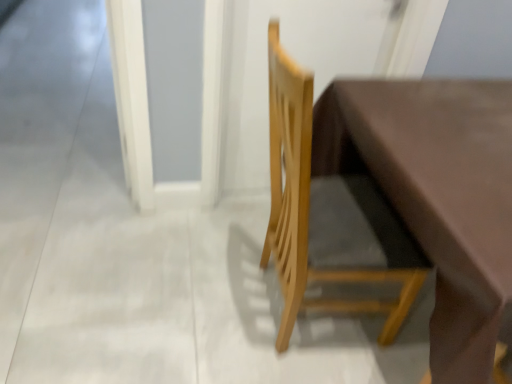
Question: Is point (325, 216) positioned closer to the camera than point (207, 120)?

Choices:
 (A) closer
 (B) farther

Answer: (A)

Question: Considering the relative positions of natural wood chair at center and white glossy screen door at lower left in the image provided, is natural wood chair at center to the left or to the right of white glossy screen door at lower left?

Choices:
 (A) left
 (B) right

Answer: (B)

Question: Based on their relative distances, which object is farther from the white glossy screen door at lower left?

Choices:
 (A) matte brown table at center
 (B) natural wood chair at center

Answer: (A)

Question: Which of these objects is positioned farthest from the natural wood chair at center?

Choices:
 (A) matte brown table at center
 (B) white glossy screen door at lower left

Answer: (B)